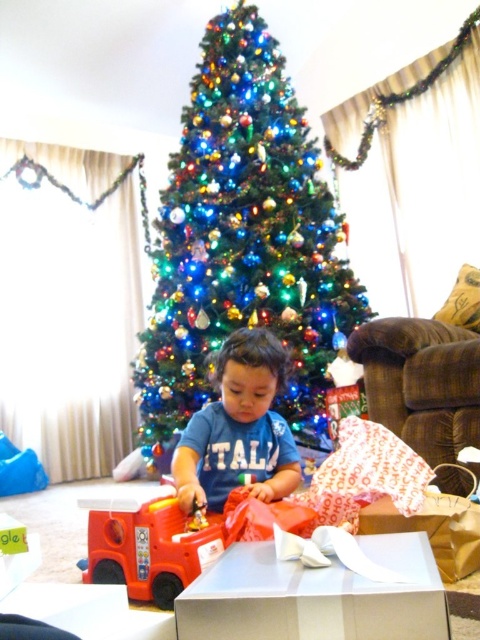
You are standing in the room and see the point at coordinates (240, 564). If you want to place a gift box that requires 36 inches of space from you to reach that point, will you be able to place it there?

The distance of point (240, 564) from viewer is 35.93 inches, so you cannot place the gift box there since it requires 36 inches of space to reach that point.

You are a delivery person who just arrived at the house. You need to place a new white glossy box at center in the room. Where should you put it based on the coordinates provided?

The white glossy box at center should be placed at point (315, 596).

You are a parent who wants to place a small gift under the Christmas tree. The white glossy box at center and the rubber fire truck at lower left are in the way. Which object should you move to create space?

The white glossy box at center is positioned over the rubber fire truck at lower left, so you should move the white glossy box at center to create space.